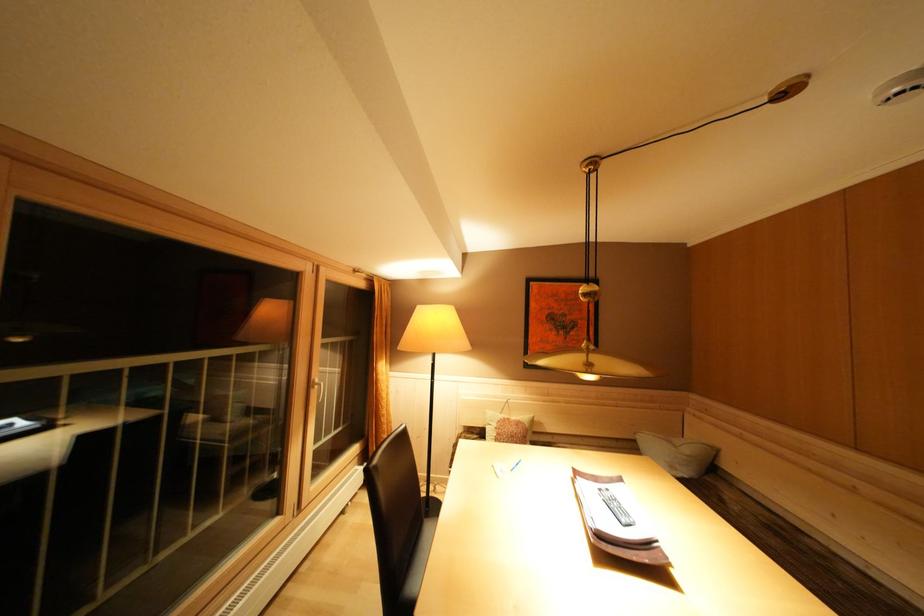
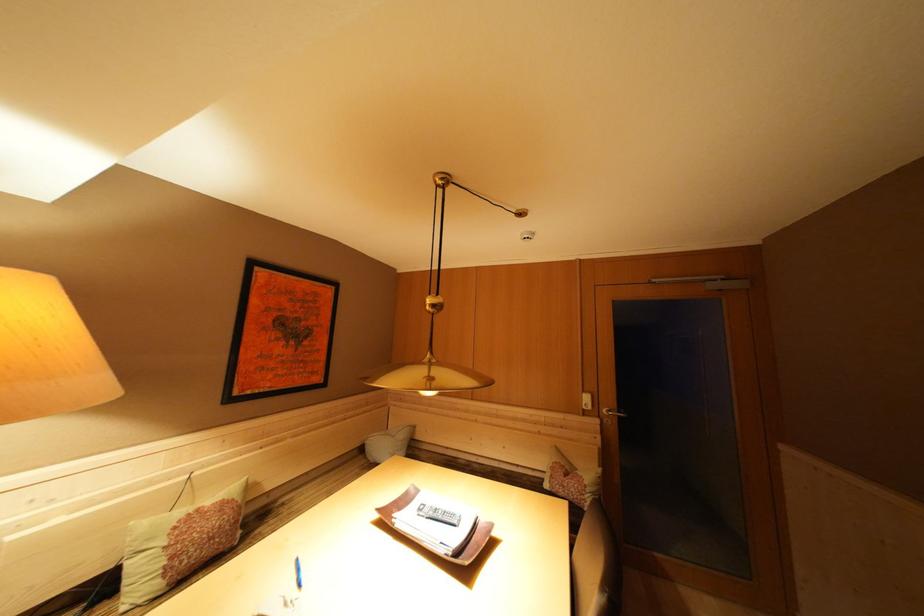
Question: The camera is either moving clockwise (left) or counter-clockwise (right) around the object. The first image is from the beginning of the video and the second image is from the end. Is the camera moving left or right when shooting the video?

Choices:
 (A) Left
 (B) Right

Answer: (A)